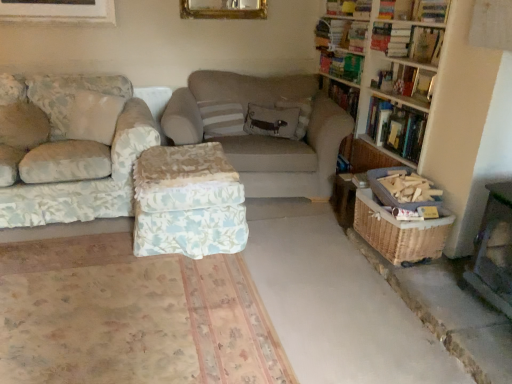
Based on the photo, what is the approximate height of brown textured concrete at lower right, the 1th concrete positioned from the right?

It is 3.73 inches.

Identify the location of brown textured concrete at lower right, acting as the second concrete starting from the left. The width and height of the screenshot is (512, 384). (339, 308).

Describe the element at coordinates (430, 10) in the screenshot. The width and height of the screenshot is (512, 384). I see `hardcover book at upper center, which is the 3th book in bottom-to-top order` at that location.

Identify the location of light brown fabric pillow at center, which is counted as the 2th pillow, starting from the right. (271, 121).

In order to face floral fabric ottoman at center, should I rotate leftwards or rightwards?

You should rotate left by 9.454 degrees.

The width and height of the screenshot is (512, 384). What do you see at coordinates (342, 65) in the screenshot?
I see `hardcover book at upper right, positioned as the fourth book in bottom-to-top order` at bounding box center [342, 65].

You are a GUI agent. You are given a task and a screenshot of the screen. Output one action in this format:
    pyautogui.click(x=<x>, y=<y>)
    Task: Click on the hardcover book at upper right, which is the second book from bottom to top
    The height and width of the screenshot is (384, 512).
    Given the screenshot: What is the action you would take?
    pyautogui.click(x=426, y=44)

You are a GUI agent. You are given a task and a screenshot of the screen. Output one action in this format:
    pyautogui.click(x=<x>, y=<y>)
    Task: Click on the brown textured concrete at lower right, the 1th concrete positioned from the right
    Image resolution: width=512 pixels, height=384 pixels.
    Given the screenshot: What is the action you would take?
    pyautogui.click(x=339, y=308)

At what (x,y) coordinates should I click in order to perform the action: click on stool that appears below the wooden bookshelf at right (from a real-world perspective). Please return your answer as a coordinate pair (x, y). The width and height of the screenshot is (512, 384). Looking at the image, I should click on (188, 202).

From a real-world perspective, is wooden bookshelf at right on floral fabric ottoman at center?

Indeed, from a real-world perspective, wooden bookshelf at right stands above floral fabric ottoman at center.

In the scene shown: Can you confirm if wooden bookshelf at right is shorter than floral fabric ottoman at center?

No.

Considering the relative positions of hardcover book at upper right, the fourth book in the top-to-bottom sequence, and floral fabric couch at left, the second studio couch when ordered from right to left, in the image provided, is hardcover book at upper right, the fourth book in the top-to-bottom sequence, to the right of floral fabric couch at left, the second studio couch when ordered from right to left, from the viewer's perspective?

Yes, hardcover book at upper right, the fourth book in the top-to-bottom sequence, is to the right of floral fabric couch at left, the second studio couch when ordered from right to left.

Locate an element on the screen. The width and height of the screenshot is (512, 384). studio couch located in front of the hardcover book at upper right, which is the second book from bottom to top is located at coordinates (69, 148).

Considering the sizes of hardcover book at upper right, the fourth book in the top-to-bottom sequence, and floral fabric couch at left, the second studio couch when ordered from right to left, in the image, is hardcover book at upper right, the fourth book in the top-to-bottom sequence, bigger or smaller than floral fabric couch at left, the second studio couch when ordered from right to left,?

Considering their sizes, hardcover book at upper right, the fourth book in the top-to-bottom sequence, takes up less space than floral fabric couch at left, the second studio couch when ordered from right to left.

From the image's perspective, would you say hardcover book at upper right, which is the second book from bottom to top, is shown under floral fabric couch at left, arranged as the 1th studio couch when viewed from the left?

No.

How many degrees apart are the facing directions of woven wicker basket at lower right and floral fabric ottoman at center?

90.7 degrees separate the facing orientations of woven wicker basket at lower right and floral fabric ottoman at center.

Is woven wicker basket at lower right positioned with its back to floral fabric ottoman at center?

That's not correct — woven wicker basket at lower right is not looking away from floral fabric ottoman at center.

Considering the points (348, 210) and (209, 180), which point is in front, point (348, 210) or point (209, 180)?

The point (209, 180) is closer.

From the picture: Is woven wicker basket at lower right spatially inside floral fabric ottoman at center, or outside of it?

woven wicker basket at lower right is located beyond the bounds of floral fabric ottoman at center.

Based on their positions, is brown textured concrete at lower right, acting as the second concrete starting from the left, located to the left or right of beige fabric studio couch at center, acting as the 2th studio couch starting from the left?

brown textured concrete at lower right, acting as the second concrete starting from the left, is positioned on beige fabric studio couch at center, acting as the 2th studio couch starting from the left,'s right side.

Image resolution: width=512 pixels, height=384 pixels. In order to click on the 1st studio couch counting from the left side of the brown textured concrete at lower right, the 1th concrete positioned from the right in this screenshot , I will do 264,136.

Is brown textured concrete at lower right, the 1th concrete positioned from the right, not near beige fabric studio couch at center, acting as the 2th studio couch starting from the left?

brown textured concrete at lower right, the 1th concrete positioned from the right, is positioned a significant distance from beige fabric studio couch at center, acting as the 2th studio couch starting from the left.

Which of these two, brown textured concrete at lower right, acting as the second concrete starting from the left, or beige fabric studio couch at center, acting as the 2th studio couch starting from the left, stands shorter?

brown textured concrete at lower right, acting as the second concrete starting from the left, is shorter.

From the image's perspective, is floral fabric couch at left, the second studio couch when ordered from right to left, located beneath hardcover book at upper right, which is counted as the 2th book, starting from the top?

Correct, floral fabric couch at left, the second studio couch when ordered from right to left, appears lower than hardcover book at upper right, which is counted as the 2th book, starting from the top, in the image.

Which is closer to the camera, [110,127] or [344,58]?

Point [110,127] appears to be closer to the viewer than point [344,58].

Is floral fabric couch at left, arranged as the 1th studio couch when viewed from the left, touching hardcover book at upper right, which is counted as the 2th book, starting from the top?

No, floral fabric couch at left, arranged as the 1th studio couch when viewed from the left, is not with hardcover book at upper right, which is counted as the 2th book, starting from the top.

Is light brown fabric pillow at center, which is counted as the 2th pillow, starting from the right, touching wooden bookshelf at right?

light brown fabric pillow at center, which is counted as the 2th pillow, starting from the right, and wooden bookshelf at right are not in contact.

Find the location of a particular element. This screenshot has width=512, height=384. bookshelf above the light brown fabric pillow at center, the 1th pillow from the left (from a real-world perspective) is located at coordinates pos(441,108).

From a real-world perspective, who is located lower, light brown fabric pillow at center, the 1th pillow from the left, or wooden bookshelf at right?

light brown fabric pillow at center, the 1th pillow from the left, from a real-world perspective.

Which is in front, point (270, 128) or point (453, 161)?

The point (453, 161) is closer to the camera.

From the image's perspective, would you say hardcover book at upper right, arranged as the 1th book when ordered from the bottom, is positioned over hardcover book at upper right, which appears as the 1th book when viewed from the top?

No.

In the scene shown: Between hardcover book at upper right, marked as the 5th book in a top-to-bottom arrangement, and hardcover book at upper right, which appears as the 1th book when viewed from the top, which one appears on the left side from the viewer's perspective?

hardcover book at upper right, which appears as the 1th book when viewed from the top.

Is hardcover book at upper right, marked as the 5th book in a top-to-bottom arrangement, in front of hardcover book at upper right, arranged as the 5th book when ordered from the bottom?

Yes, the depth of hardcover book at upper right, marked as the 5th book in a top-to-bottom arrangement, is less than that of hardcover book at upper right, arranged as the 5th book when ordered from the bottom.

Between hardcover book at upper right, marked as the 5th book in a top-to-bottom arrangement, and hardcover book at upper right, arranged as the 5th book when ordered from the bottom, which one has smaller size?

With smaller size is hardcover book at upper right, arranged as the 5th book when ordered from the bottom.

Identify the location of stool on the left of wooden bookshelf at right. The width and height of the screenshot is (512, 384). (188, 202).

From a real-world perspective, starting from the floral fabric couch at left, arranged as the 1th studio couch when viewed from the left, which book is the 4th one vertically above it? Please provide its 2D coordinates.

[(426, 44)]

From the image, which object appears to be farther from smooth concrete floor at center, acting as the second concrete starting from the right, light brown fabric pillow at center, which is counted as the 2th pillow, starting from the right, or beige fabric studio couch at center, acting as the 2th studio couch starting from the left?

Among the two, light brown fabric pillow at center, which is counted as the 2th pillow, starting from the right, is located further to smooth concrete floor at center, acting as the second concrete starting from the right.

From the image, which object appears to be farther from beige fabric studio couch at center, acting as the 2th studio couch starting from the left, wooden bookshelf at upper right or hardcover book at upper right, which is the second book from bottom to top?

hardcover book at upper right, which is the second book from bottom to top, is positioned further to the anchor beige fabric studio couch at center, acting as the 2th studio couch starting from the left.

From the image, which object appears to be farther from embroidered fabric pillow at center, the 1th pillow in the right-to-left sequence, hardcover book at upper right, arranged as the 1th book when ordered from the bottom, or hardcover book at upper right, positioned as the fourth book in bottom-to-top order?

hardcover book at upper right, arranged as the 1th book when ordered from the bottom, is further to embroidered fabric pillow at center, the 1th pillow in the right-to-left sequence.

When comparing their distances from wooden bookshelf at upper right, does beige fabric studio couch at center, acting as the 2th studio couch starting from the left, or hardcover book at upper right, which appears as the 1th book when viewed from the top, seem further?

The object further to wooden bookshelf at upper right is beige fabric studio couch at center, acting as the 2th studio couch starting from the left.

Which object lies further to the anchor point hardcover book at upper right, the fourth book in the top-to-bottom sequence, light brown fabric pillow at center, the 1th pillow from the left, or hardcover book at upper right, marked as the 5th book in a top-to-bottom arrangement?

light brown fabric pillow at center, the 1th pillow from the left.

Which object lies further to the anchor point hardcover book at upper center, which is the 3th book in bottom-to-top order, beige fabric studio couch at center, acting as the 2th studio couch starting from the left, or hardcover book at upper right, which is counted as the 2th book, starting from the top?

Among the two, beige fabric studio couch at center, acting as the 2th studio couch starting from the left, is located further to hardcover book at upper center, which is the 3th book in bottom-to-top order.

From the image, which object appears to be farther from woven wicker basket at lower right, floral fabric ottoman at center or woven brown basket at lower right?

Among the two, floral fabric ottoman at center is located further to woven wicker basket at lower right.

Estimate the real-world distances between objects in this image. Which object is closer to wooden bookshelf at upper right, smooth concrete floor at center, acting as the second concrete starting from the right, or beige fabric studio couch at center, acting as the 2th studio couch starting from the left?

beige fabric studio couch at center, acting as the 2th studio couch starting from the left, is closer to wooden bookshelf at upper right.

You are a GUI agent. You are given a task and a screenshot of the screen. Output one action in this format:
    pyautogui.click(x=<x>, y=<y>)
    Task: Click on the concrete between floral fabric couch at left, the second studio couch when ordered from right to left, and hardcover book at upper right, positioned as the fourth book in bottom-to-top order, in the horizontal direction
    
    Given the screenshot: What is the action you would take?
    pyautogui.click(x=339, y=307)

Locate an element on the screen. The width and height of the screenshot is (512, 384). book between wooden bookshelf at right and woven wicker basket at lower right in the vertical direction is located at coordinates (396, 128).

At what (x,y) coordinates should I click in order to perform the action: click on side table between hardcover book at upper right, positioned as the fourth book in bottom-to-top order, and woven brown basket at lower right from top to bottom. Please return your answer as a coordinate pair (x, y). The height and width of the screenshot is (384, 512). Looking at the image, I should click on (343, 199).

Where is `side table positioned between woven brown basket at lower right and light brown fabric pillow at center, the 1th pillow from the left, from near to far`? side table positioned between woven brown basket at lower right and light brown fabric pillow at center, the 1th pillow from the left, from near to far is located at coordinates (343, 199).